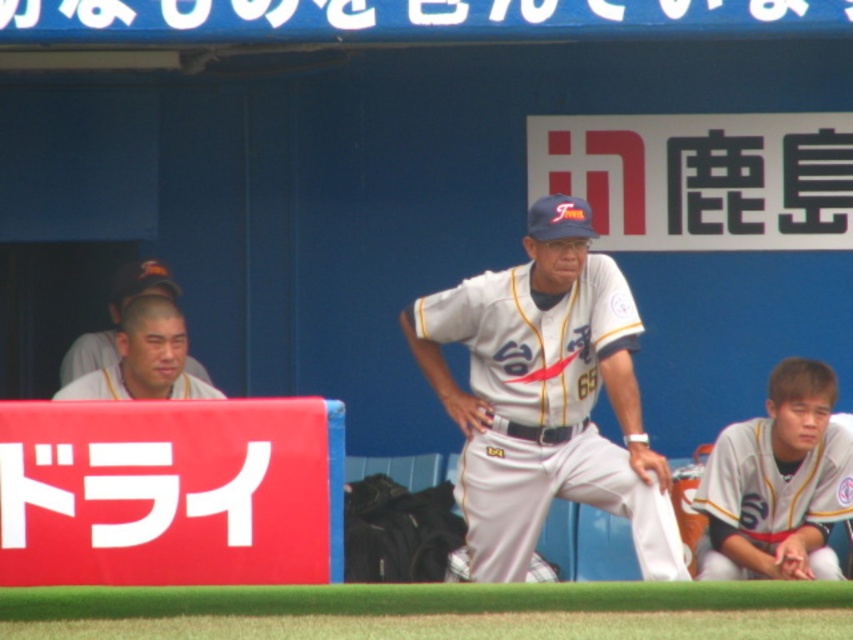
Based on the photo, you are a photographer trying to capture a candid shot of both the white uniform at lower right and the white fabric baseball uniform at left. Since you want to ensure both are clearly visible in the frame, which one should you focus on first to account for their sizes?

The white uniform at lower right is bigger than the white fabric baseball uniform at left, so you should focus on the white uniform at lower right first to ensure it is in clear focus before adjusting for the smaller one.

Based on the scene description, where is the white fabric uniform at center located in terms of coordinates?

The white fabric uniform at center is located at point coordinates of 0.620 and 0.640.

Based on the scene description, which object has a greater width between the white fabric baseball uniform at center and the white fabric baseball uniform at left?

The white fabric baseball uniform at center has a greater width compared to the white fabric baseball uniform at left.